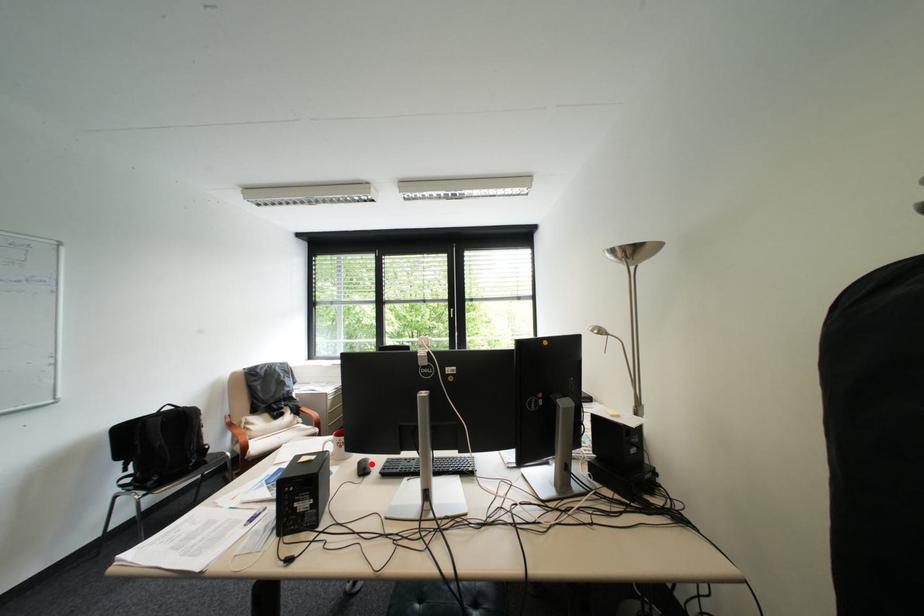
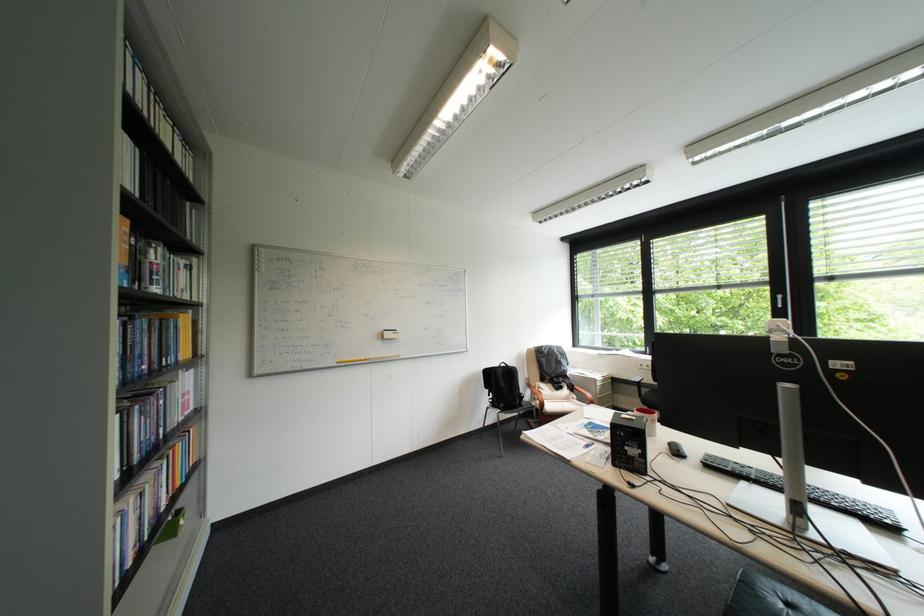
Question: I am providing you with two images of the same scene from different viewpoints. A red point is shown in image1. For the corresponding object point in image2, is it positioned nearer or farther from the camera?

Choices:
 (A) Nearer
 (B) Farther

Answer: (A)